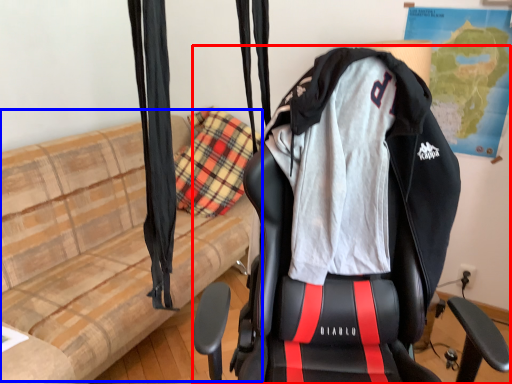
Question: Which object is further to the camera taking this photo, chair (highlighted by a red box) or couch (highlighted by a blue box)?

Choices:
 (A) chair
 (B) couch

Answer: (B)